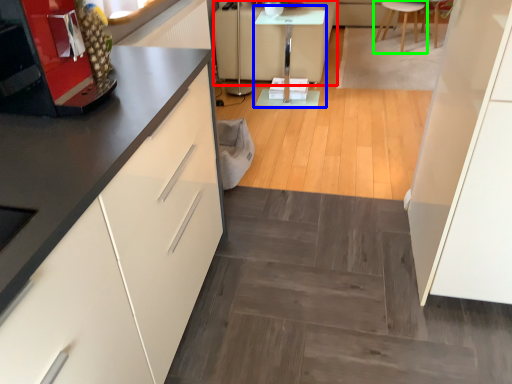
Question: Estimate the real-world distances between objects in this image. Which object is closer to couch (highlighted by a red box), table (highlighted by a blue box) or furniture (highlighted by a green box)?

Choices:
 (A) table
 (B) furniture

Answer: (A)